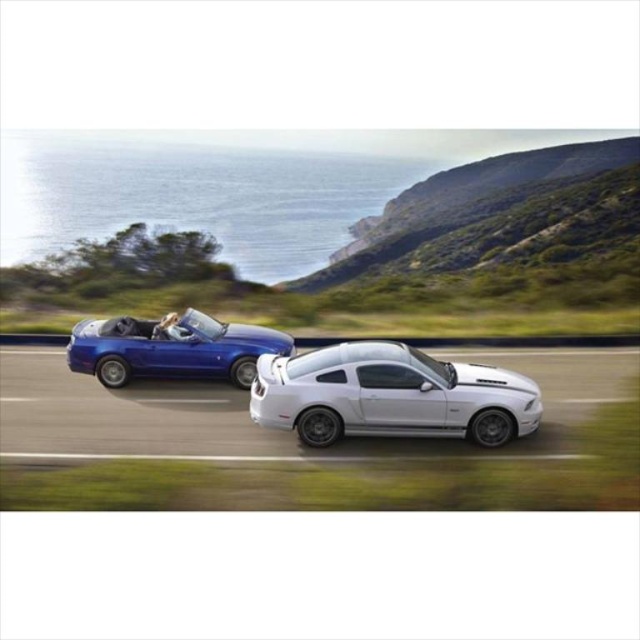
In the scene shown: Between white glossy car at center and shiny metallic blue convertible at left, which one appears on the right side from the viewer's perspective?

white glossy car at center is more to the right.

Which of these two, white glossy car at center or shiny metallic blue convertible at left, stands taller?

Standing taller between the two is white glossy car at center.

Is point (477, 419) farther from viewer compared to point (173, 371)?

That is False.

Locate an element on the screen. This screenshot has height=640, width=640. white glossy car at center is located at coordinates (390, 396).